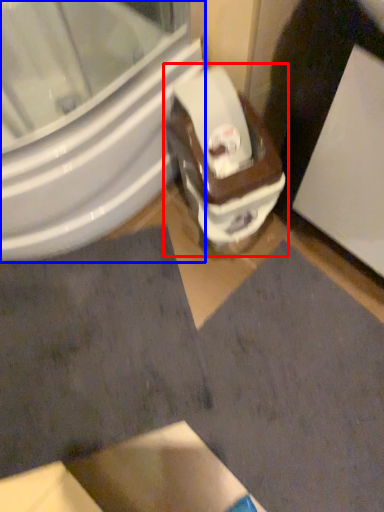
Question: Among these objects, which one is nearest to the camera, toilet (highlighted by a red box) or bidet (highlighted by a blue box)?

Choices:
 (A) toilet
 (B) bidet

Answer: (B)